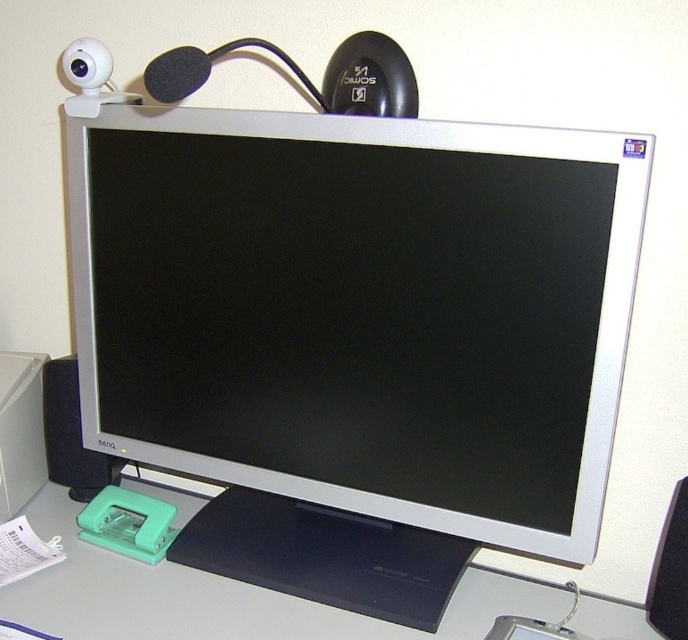
Question: Is white matte computer desk at lower center bigger than black plastic speaker at lower left?

Choices:
 (A) no
 (B) yes

Answer: (B)

Question: Which object appears closest to the camera in this image?

Choices:
 (A) white matte computer desk at lower center
 (B) silver metallic monitor at center
 (C) black plastic speaker at lower left

Answer: (B)

Question: Which of the following is the farthest from the observer?

Choices:
 (A) (78, 481)
 (B) (541, 620)

Answer: (A)

Question: Which point is farther to the camera?

Choices:
 (A) (58, 422)
 (B) (585, 268)
 (C) (184, 506)
 (D) (649, 611)

Answer: (C)

Question: Considering the relative positions of silver metallic monitor at center and black matte speaker at lower right in the image provided, where is silver metallic monitor at center located with respect to black matte speaker at lower right?

Choices:
 (A) left
 (B) right

Answer: (A)

Question: Does black plastic speaker at lower left have a lesser width compared to black matte speaker at lower right?

Choices:
 (A) yes
 (B) no

Answer: (B)